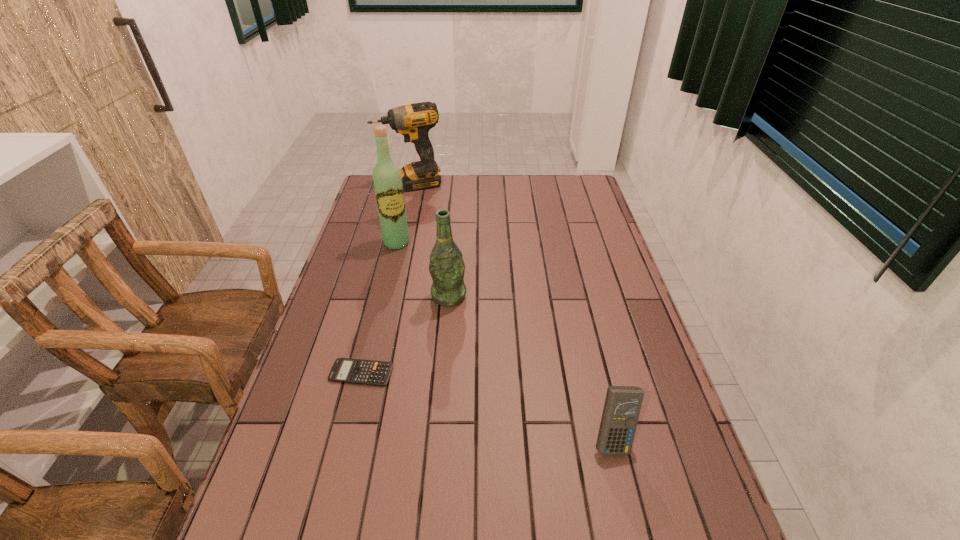
I want to click on vacant space located on the front-facing side of the taller calculator, so click(631, 514).

Locate an element on the screen. This screenshot has height=540, width=960. vacant position located 0.350m on the surface of the third nearest object is located at coordinates (444, 413).

The image size is (960, 540). Find the location of `vacant area located 0.280m on the surface of the third nearest object`. vacant area located 0.280m on the surface of the third nearest object is located at coordinates (445, 388).

Image resolution: width=960 pixels, height=540 pixels. I want to click on free space located 0.150m on the surface of the third nearest object, so click(x=447, y=348).

Locate an element on the screen. Image resolution: width=960 pixels, height=540 pixels. free space located 0.280m on the front-facing side of the tallest object is located at coordinates (421, 303).

The image size is (960, 540). Find the location of `free location located on the front-facing side of the tallest object`. free location located on the front-facing side of the tallest object is located at coordinates (423, 308).

Image resolution: width=960 pixels, height=540 pixels. I want to click on vacant area situated on the front-facing side of the tallest object, so click(433, 331).

Where is `vacant space located with the drill bit of the farthest object facing forward`? The width and height of the screenshot is (960, 540). vacant space located with the drill bit of the farthest object facing forward is located at coordinates (423, 202).

This screenshot has height=540, width=960. I want to click on vacant space located 0.400m with the drill bit of the farthest object facing forward, so click(443, 248).

Locate an element on the screen. This screenshot has height=540, width=960. vacant point located 0.140m with the drill bit of the farthest object facing forward is located at coordinates (426, 210).